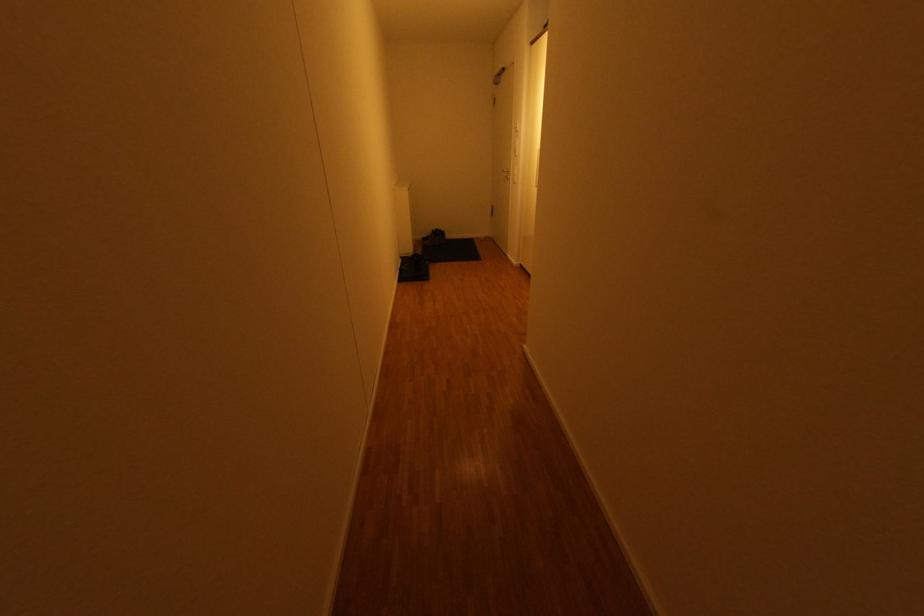
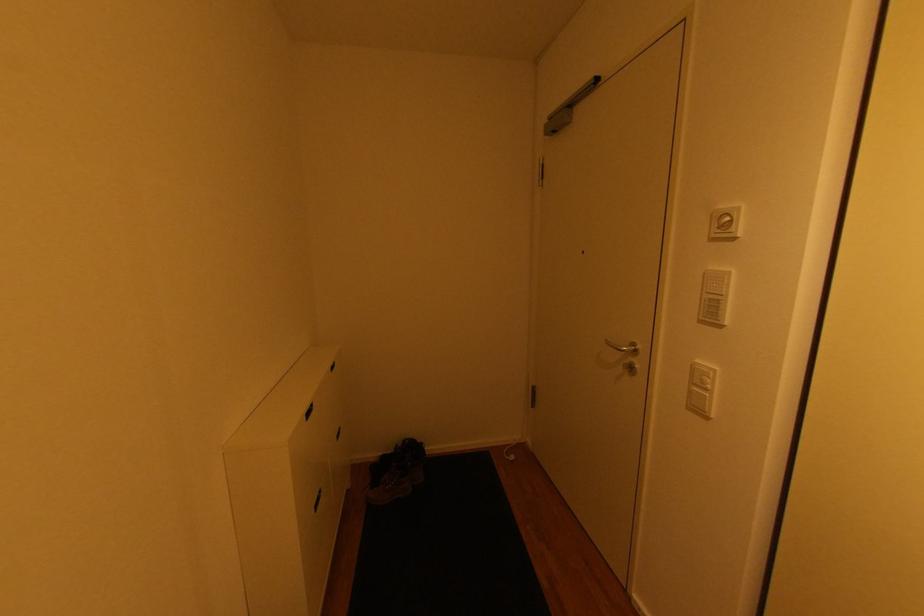
Question: What movement of the cameraman would produce the second image?

Choices:
 (A) Left
 (B) Right
 (C) Forward
 (D) Backward

Answer: (C)